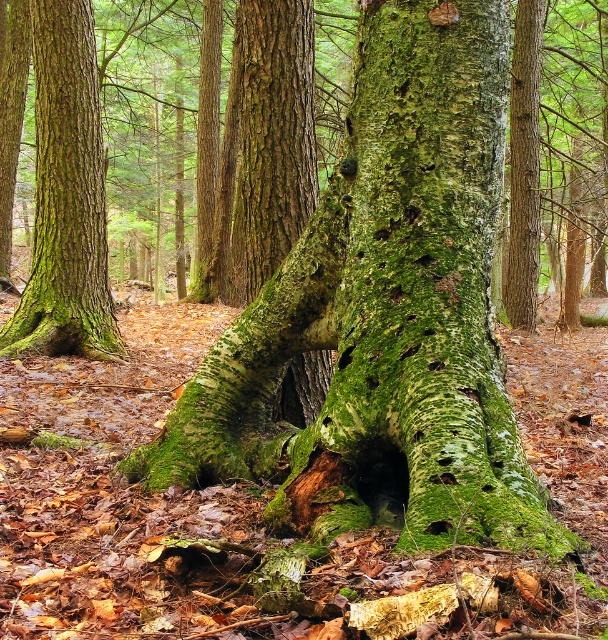
Question: Which object appears closest to the camera in this image?

Choices:
 (A) green mossy tree trunk at left
 (B) green mossy tree trunk at center

Answer: (B)

Question: Is green mossy tree trunk at left thinner than green mossy tree trunk at center?

Choices:
 (A) yes
 (B) no

Answer: (B)

Question: Among these objects, which one is farthest from the camera?

Choices:
 (A) green mossy tree trunk at center
 (B) green mossy tree trunk at left

Answer: (B)

Question: Is green mossy tree trunk at left below green mossy tree trunk at center?

Choices:
 (A) no
 (B) yes

Answer: (A)

Question: Does green mossy tree trunk at left have a greater width compared to green mossy tree trunk at center?

Choices:
 (A) no
 (B) yes

Answer: (B)